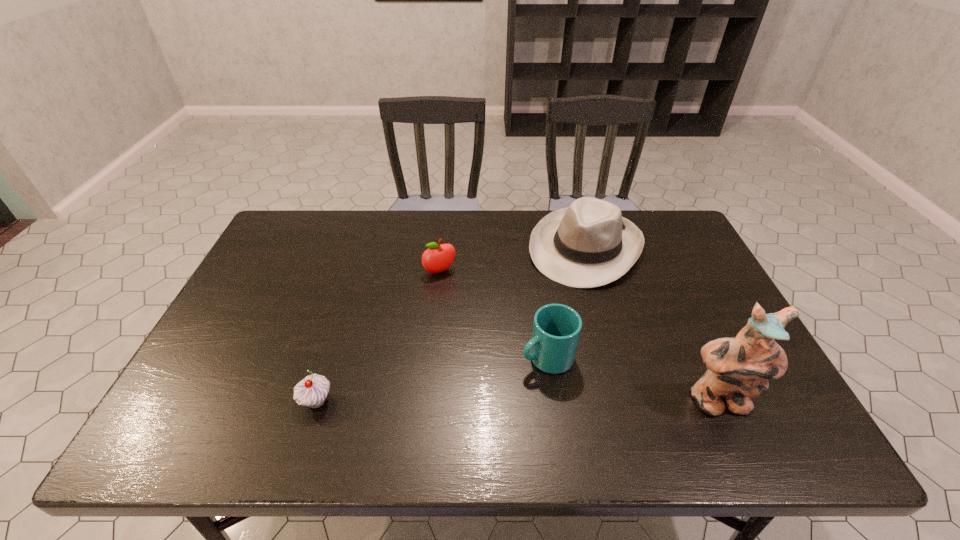
Find the location of a particular element. The height and width of the screenshot is (540, 960). object that is at the far right corner is located at coordinates (589, 244).

The image size is (960, 540). Identify the location of object that is at the near right corner. (739, 368).

Locate an element on the screen. The width and height of the screenshot is (960, 540). vacant area at the far edge of the desktop is located at coordinates (454, 240).

At what (x,y) coordinates should I click in order to perform the action: click on free region at the near edge of the desktop. Please return your answer as a coordinate pair (x, y). Image resolution: width=960 pixels, height=540 pixels. Looking at the image, I should click on (623, 395).

I want to click on free space at the left edge, so click(235, 300).

I want to click on vacant space at the far left corner of the desktop, so click(309, 231).

In the image, there is a desktop. At what (x,y) coordinates should I click in order to perform the action: click on vacant space at the far right corner. Please return your answer as a coordinate pair (x, y). The height and width of the screenshot is (540, 960). Looking at the image, I should click on (679, 236).

Where is `vacant space at the near right corner`? vacant space at the near right corner is located at coordinates (775, 406).

You are a GUI agent. You are given a task and a screenshot of the screen. Output one action in this format:
    pyautogui.click(x=<x>, y=<y>)
    Task: Click on the empty space between the fedora and the fourth object from right to left
    The image size is (960, 540).
    Given the screenshot: What is the action you would take?
    pyautogui.click(x=513, y=260)

Where is `vacant area that lies between the cupcake and the figurine`? The image size is (960, 540). vacant area that lies between the cupcake and the figurine is located at coordinates (517, 402).